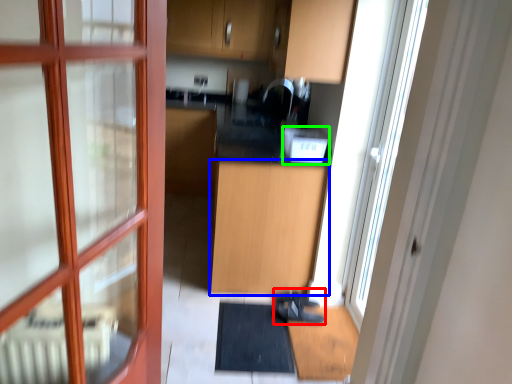
Question: Which object is positioned closest to shoe (highlighted by a red box)? Select from cabinetry (highlighted by a blue box) and appliance (highlighted by a green box).

Choices:
 (A) cabinetry
 (B) appliance

Answer: (A)